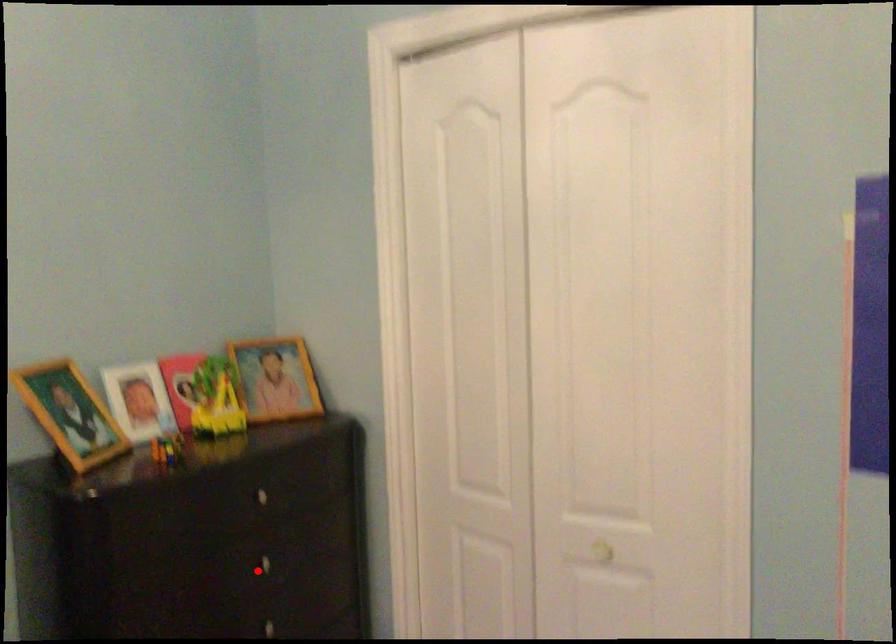
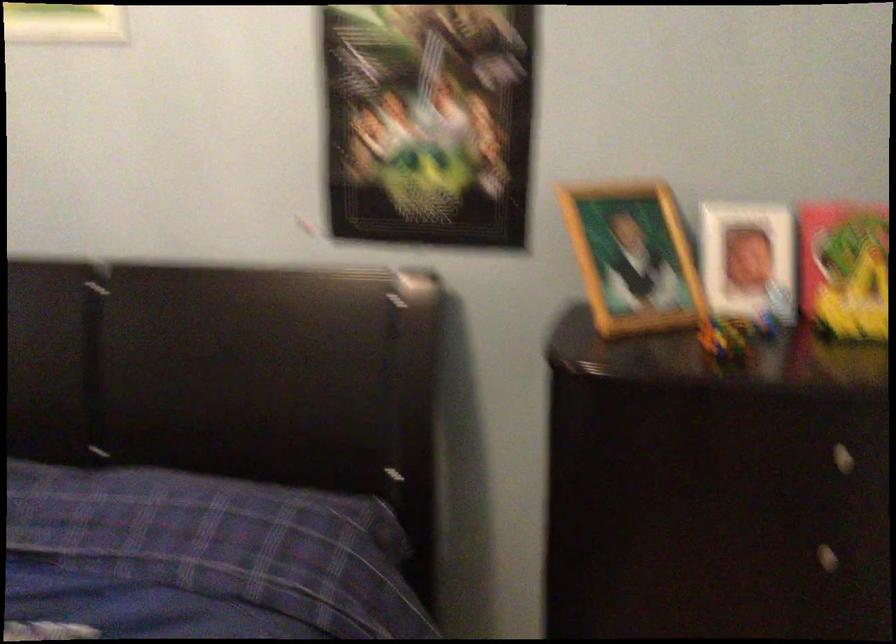
In the second image, find the point that corresponds to the highlighted location in the first image.

(807, 554)